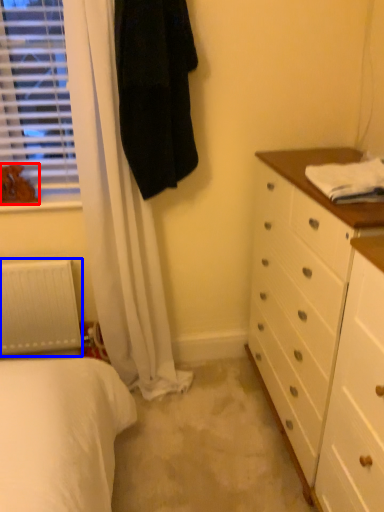
Question: Which of the following is the farthest to the observer, animal (highlighted by a red box) or radiator (highlighted by a blue box)?

Choices:
 (A) animal
 (B) radiator

Answer: (B)